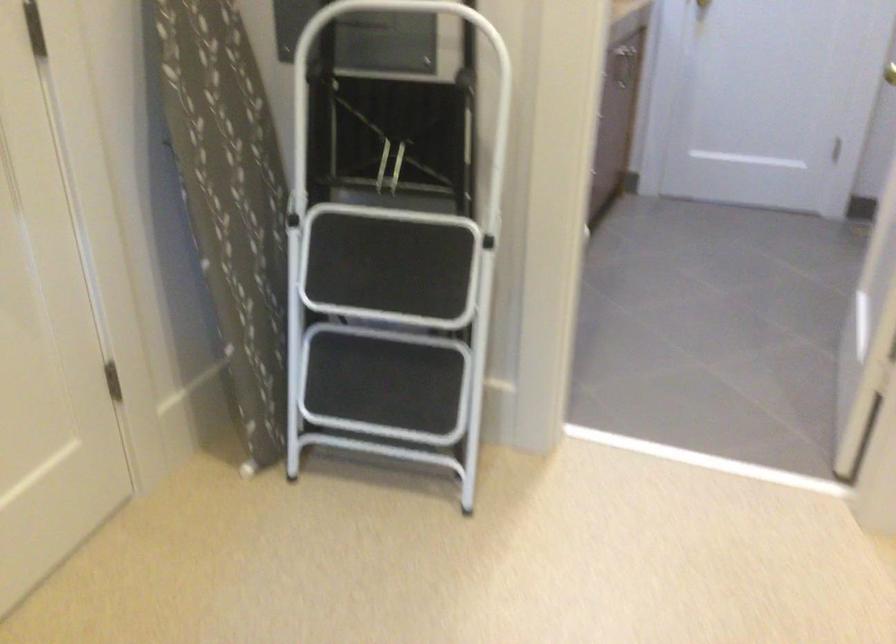
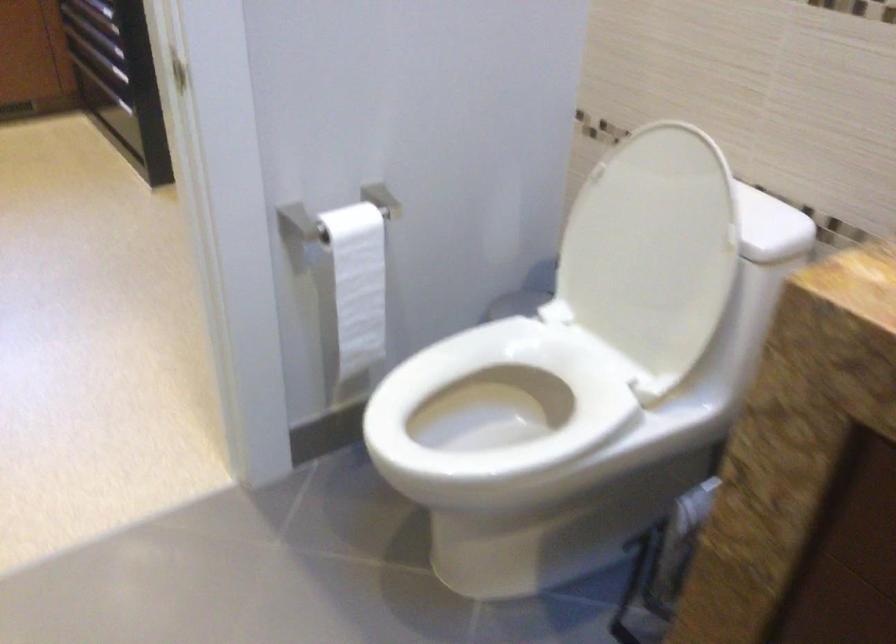
Question: I am providing you with two images of the same scene from different viewpoints. Please identify which objects are invisible in image2.

Choices:
 (A) black stool step
 (B) white toilet lid
 (C) small calculator
 (D) white toilet paper roll

Answer: (A)